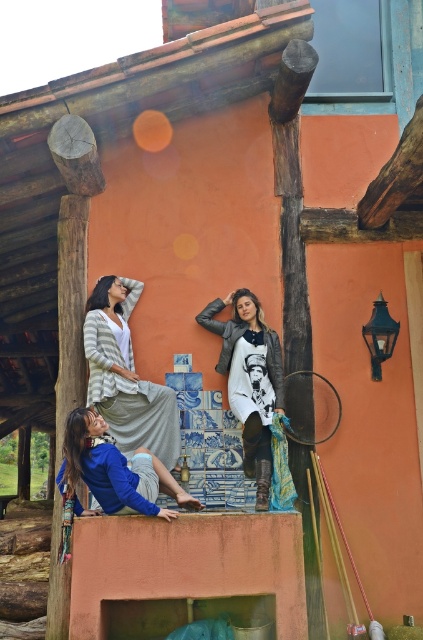
You are a tailor who needs to create a new garment. You observe the striped knit cardigan at upper center and the blue cotton shirt at lower left. Which garment has a smaller width?

The striped knit cardigan at upper center has a smaller width than the blue cotton shirt at lower left according to the description.

You are a photographer trying to capture a clear shot of the leather jacket at center without the striped knit cardigan at upper center blocking it. What adjustment should you make to your position?

Move your position forward so that the leather jacket at center comes into view in front of the striped knit cardigan at upper center.

You are standing in front of the wooden structure and want to hand a gift to both the leather jacket at center and the blue cotton shirt at lower left. Which person should you approach first to ensure you can reach them without moving too far?

You should approach the leather jacket at center first because it is closer to you than the blue cotton shirt at lower left, so you can reach them without moving as much.